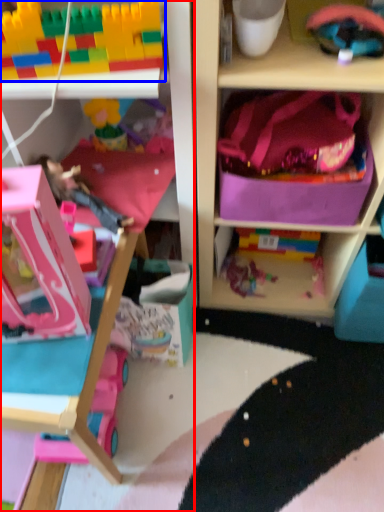
Question: Which object is closer to the camera taking this photo, cabinetry (highlighted by a red box) or toy (highlighted by a blue box)?

Choices:
 (A) cabinetry
 (B) toy

Answer: (B)